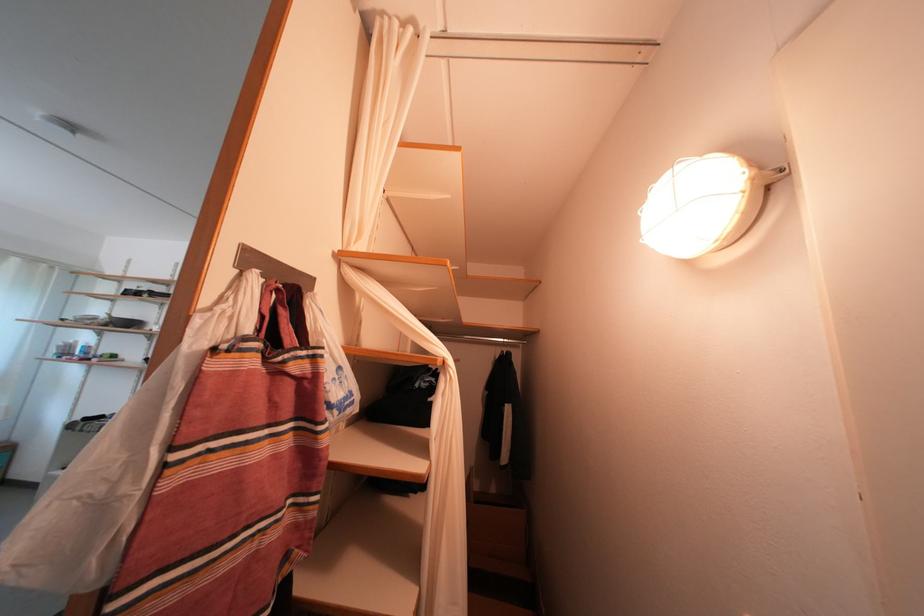
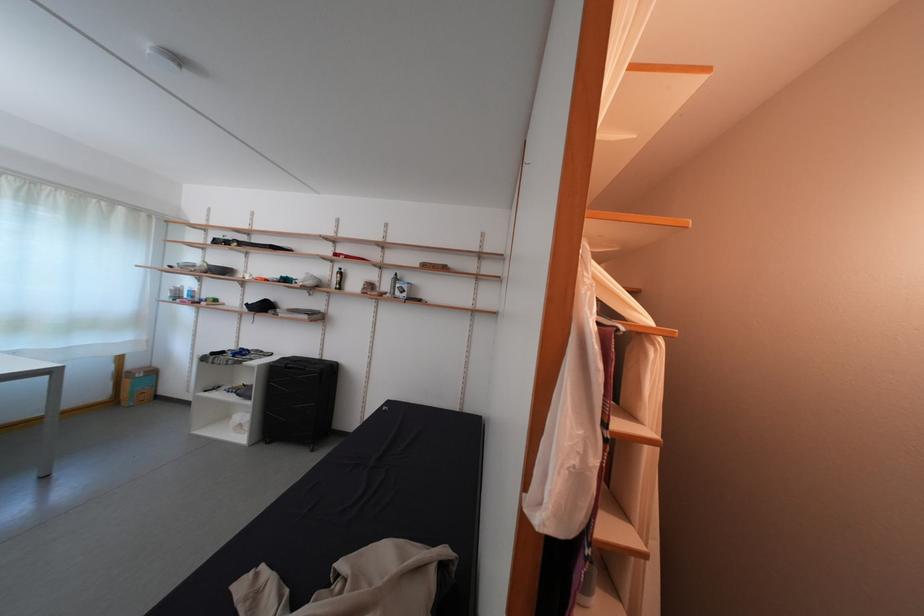
Question: Based on the continuous images, in which direction is the camera rotating? Reply with the corresponding letter.

Choices:
 (A) Left
 (B) Right
 (C) Up
 (D) Down

Answer: (D)